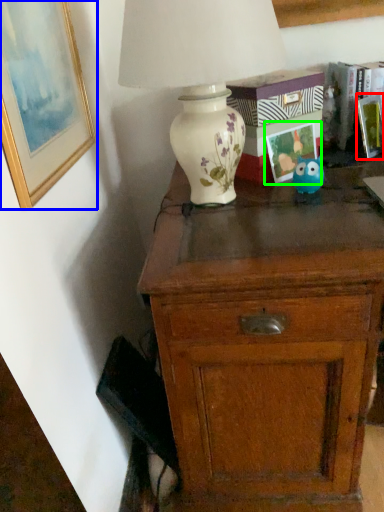
Question: Which is nearer to the picture frame (highlighted by a red box)? picture frame (highlighted by a blue box) or picture frame (highlighted by a green box).

Choices:
 (A) picture frame
 (B) picture frame

Answer: (B)